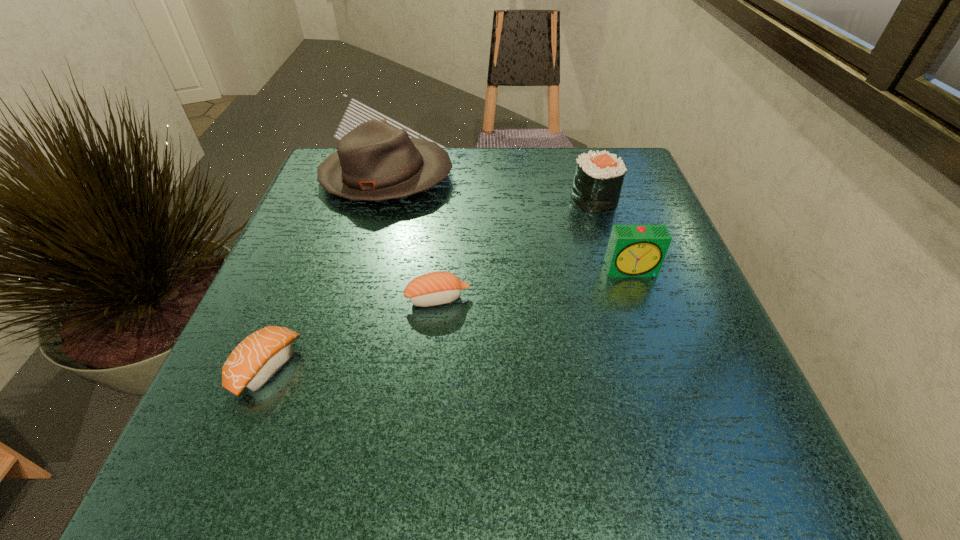
Locate an element on the screen. This screenshot has height=540, width=960. free space located on the front-facing side of the alarm clock is located at coordinates coord(657,345).

Find the location of a particular element. vacant space located 0.110m on the right of the second nearest object is located at coordinates (533, 299).

This screenshot has height=540, width=960. In order to click on vacant region located on the right of the nearest object in this screenshot , I will do `click(472, 367)`.

The image size is (960, 540). I want to click on hat at the far edge, so click(375, 161).

Find the location of a particular element. sushi that is at the far edge is located at coordinates (598, 179).

This screenshot has width=960, height=540. In order to click on hat that is positioned at the left edge in this screenshot , I will do `click(375, 161)`.

In order to click on sushi present at the left edge in this screenshot , I will do `click(255, 360)`.

You are a GUI agent. You are given a task and a screenshot of the screen. Output one action in this format:
    pyautogui.click(x=<x>, y=<y>)
    Task: Click on the sushi present at the right edge
    The height and width of the screenshot is (540, 960).
    Given the screenshot: What is the action you would take?
    pyautogui.click(x=598, y=179)

Locate an element on the screen. alarm clock present at the right edge is located at coordinates (633, 250).

What are the coordinates of `object that is positioned at the far left corner` in the screenshot? It's located at (375, 161).